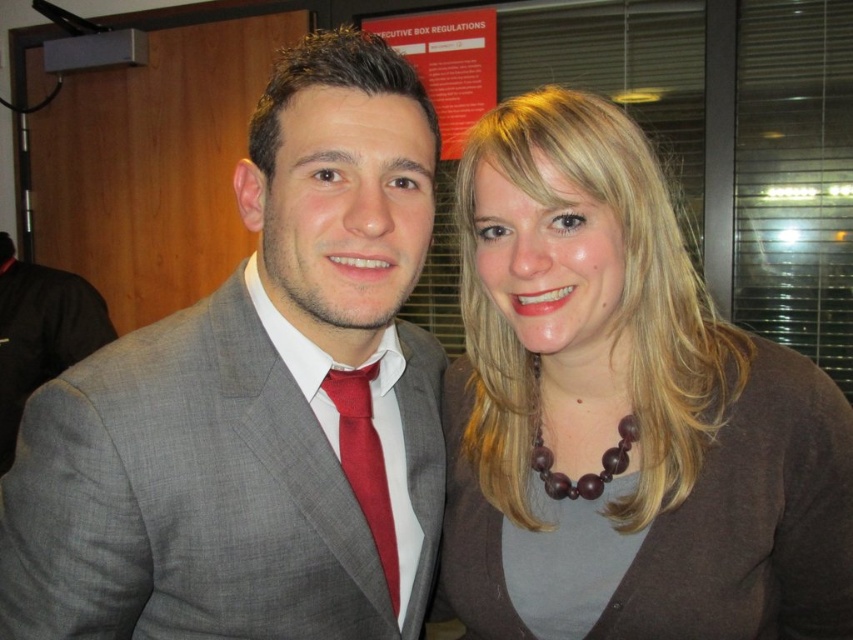
Is brown matte necklace at upper right to the right of matte gray suit at left from the viewer's perspective?

Indeed, brown matte necklace at upper right is positioned on the right side of matte gray suit at left.

Does brown matte necklace at upper right appear over matte gray suit at left?

Actually, brown matte necklace at upper right is below matte gray suit at left.

What are the coordinates of `brown matte necklace at upper right` in the screenshot? It's located at (624, 412).

Where is `brown matte necklace at upper right`? This screenshot has height=640, width=853. brown matte necklace at upper right is located at coordinates pos(624,412).

Is the position of matte gray suit at left more distant than that of matte red tie at center?

Yes, matte gray suit at left is further from the viewer.

Locate an element on the screen. matte gray suit at left is located at coordinates (39, 332).

Can you confirm if matte gray suit at center is shorter than matte gray suit at left?

Indeed, matte gray suit at center has a lesser height compared to matte gray suit at left.

Is matte gray suit at center below matte gray suit at left?

No.

Who is more forward, (370,465) or (24,326)?

Positioned in front is point (370,465).

At what (x,y) coordinates should I click in order to perform the action: click on matte gray suit at center. Please return your answer as a coordinate pair (x, y). Image resolution: width=853 pixels, height=640 pixels. Looking at the image, I should click on (258, 403).